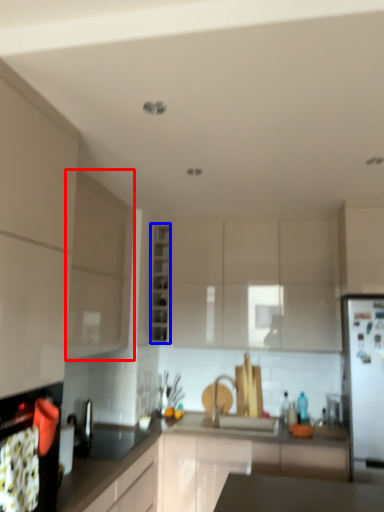
Question: Which point is closer to the camera, cabinetry (highlighted by a red box) or cabinetry (highlighted by a blue box)?

Choices:
 (A) cabinetry
 (B) cabinetry

Answer: (A)